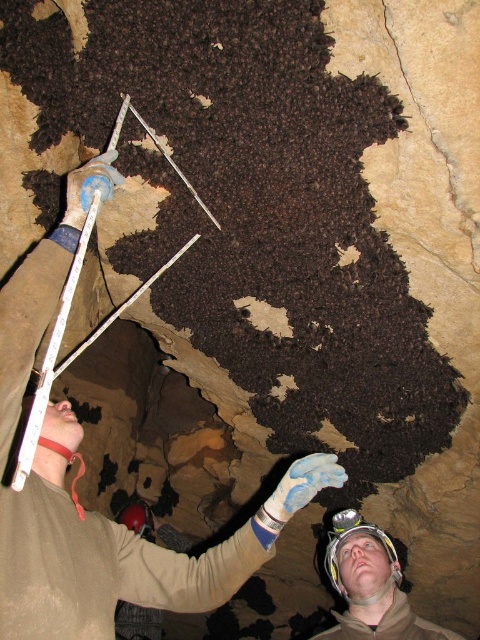
You are a researcher in the cave and need to locate your equipment. You remember placing your tan leather glove at upper center and white hard hat at center. According to the scene, which object is positioned to the left side?

The tan leather glove at upper center is located to the left of the white hard hat at center, so the tan leather glove at upper center is positioned to the left side.

You are a safety inspector in the cave. You notice the tan leather glove at upper center and the white hard hat at center. According to safety protocols, which item should be placed above the other?

The tan leather glove at upper center should be positioned over the white hard hat at center to comply with safety protocols.

You are standing at the point labeled as point (x=74, y=432) in the cave. You want to move to the cave entrance, which is behind you. Can you turn around and walk backward without hitting the cave wall? The cave walls are 2.5 meters away from you in all directions.

The point (x=74, y=432) and viewer are 1.87 meters apart from each other. Since the cave walls are 2.5 meters away in all directions, there is enough space between you and the walls to turn around and walk backward safely.